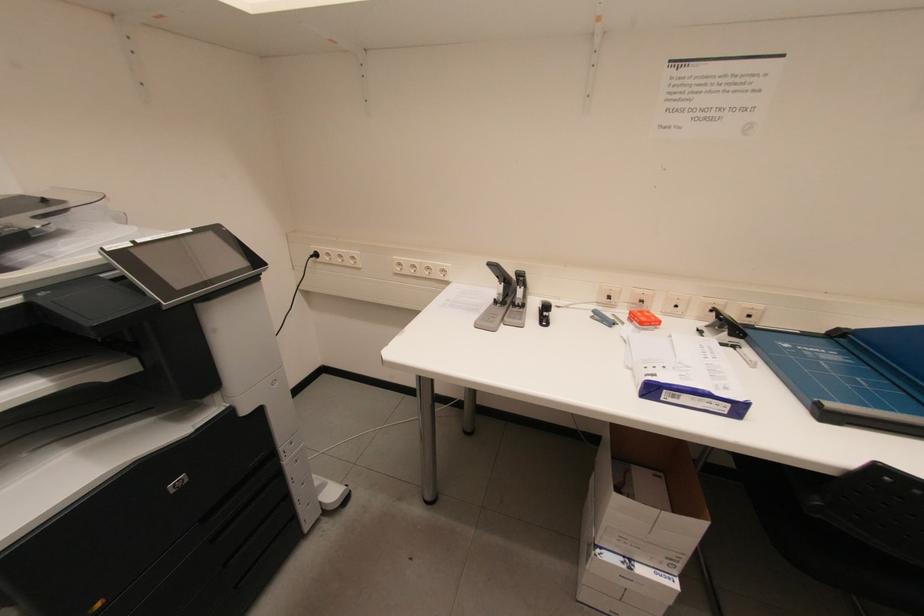
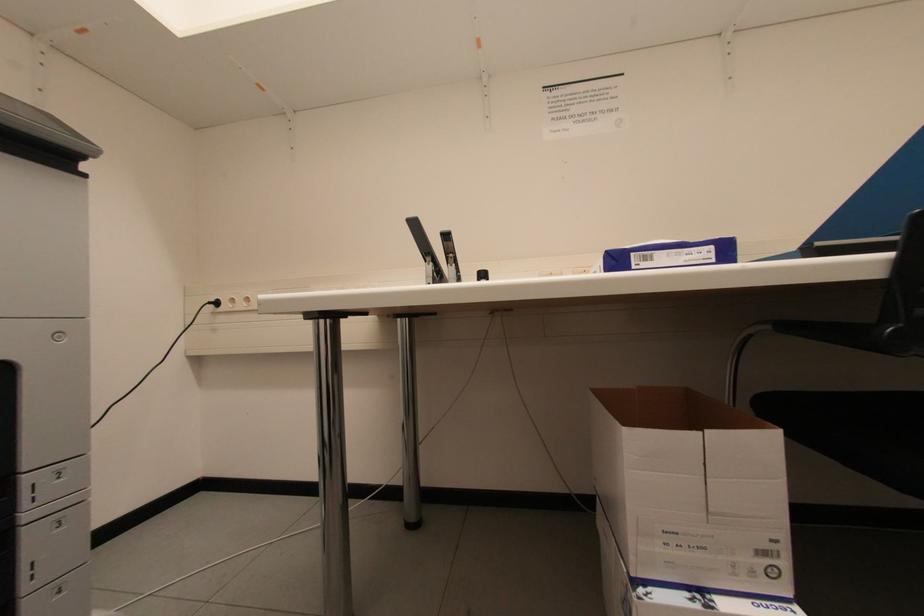
Question: The images are taken continuously from a first-person perspective. In which direction are you moving?

Choices:
 (A) Left
 (B) Right
 (C) Forward
 (D) Backward

Answer: (C)